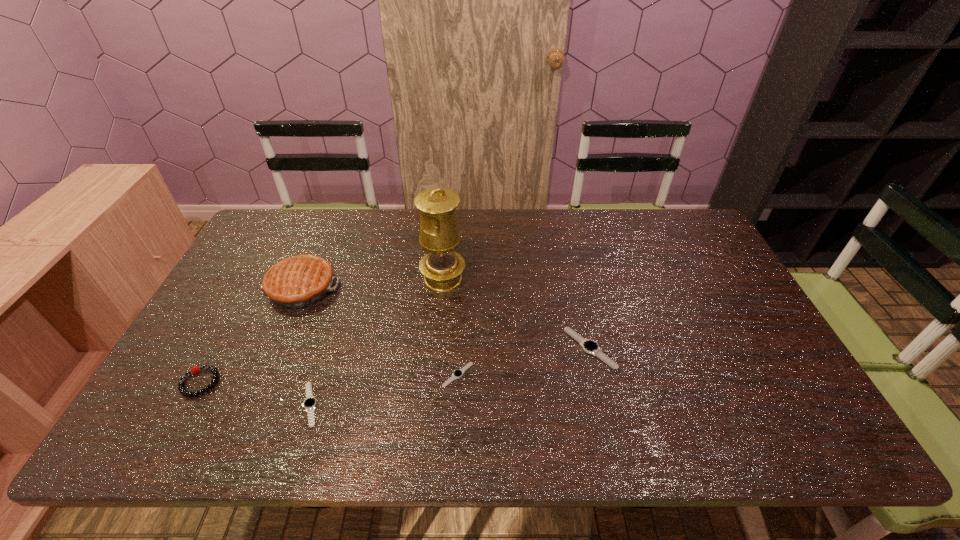
Where is `free area in between the shortest watch and the fifth shortest object`? free area in between the shortest watch and the fifth shortest object is located at coordinates (380, 331).

At what (x,y) coordinates should I click in order to perform the action: click on free area in between the shortest object and the fifth shortest object. Please return your answer as a coordinate pair (x, y). The height and width of the screenshot is (540, 960). Looking at the image, I should click on (380, 331).

Where is `empty location between the shortest object and the pie`? The width and height of the screenshot is (960, 540). empty location between the shortest object and the pie is located at coordinates (380, 331).

The image size is (960, 540). In order to click on empty space that is in between the rightmost object and the bracelet in this screenshot , I will do `click(395, 365)`.

The height and width of the screenshot is (540, 960). Find the location of `free space between the fifth tallest object and the fifth shortest object`. free space between the fifth tallest object and the fifth shortest object is located at coordinates (306, 346).

Find the location of `object that ranks as the second closest to the third tallest object`. object that ranks as the second closest to the third tallest object is located at coordinates (309, 404).

Locate an element on the screen. This screenshot has width=960, height=540. object that is the fifth closest to the oil lamp is located at coordinates (181, 388).

Locate which watch is the closest to the second watch from right to left. Please provide its 2D coordinates. Your answer should be formatted as a tuple, i.e. [(x, y)], where the tuple contains the x and y coordinates of a point satisfying the conditions above.

[(591, 347)]

Find the location of a particular element. the closest watch relative to the rightmost object is located at coordinates (458, 373).

What are the coordinates of `vacant area that satisfies the following two spatial constraints: 1. on the front side of the pie; 2. on the left side of the leftmost watch` in the screenshot? It's located at (252, 404).